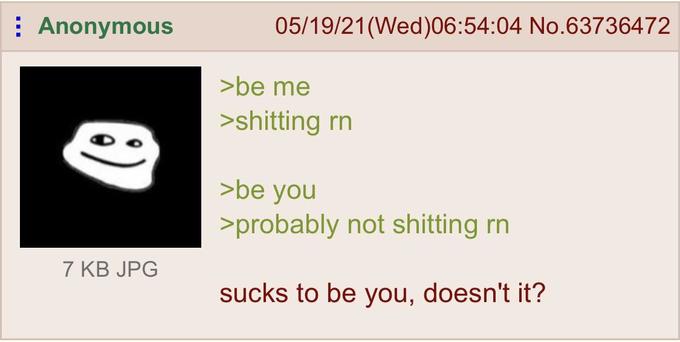
The image size is (680, 342). Identify the location of storage. (103, 265).